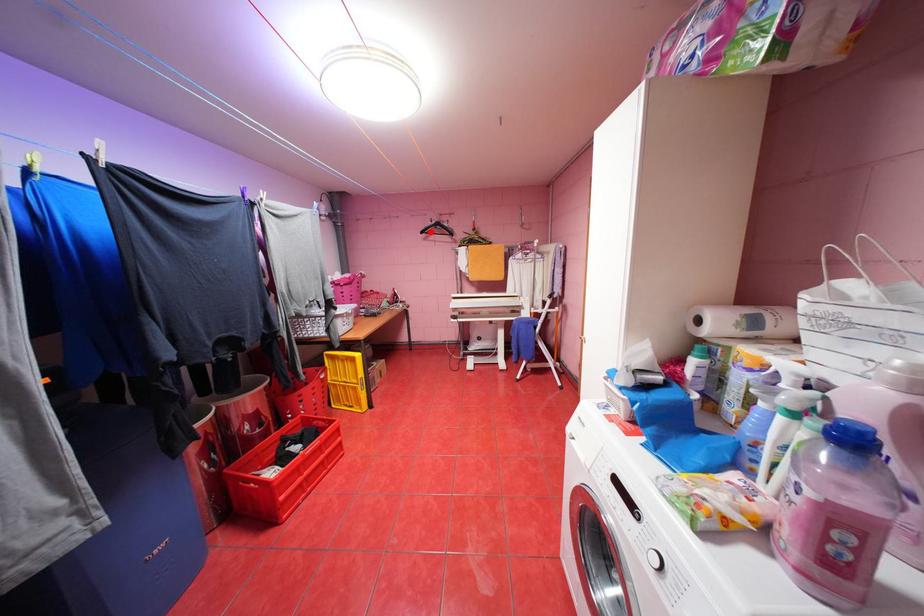
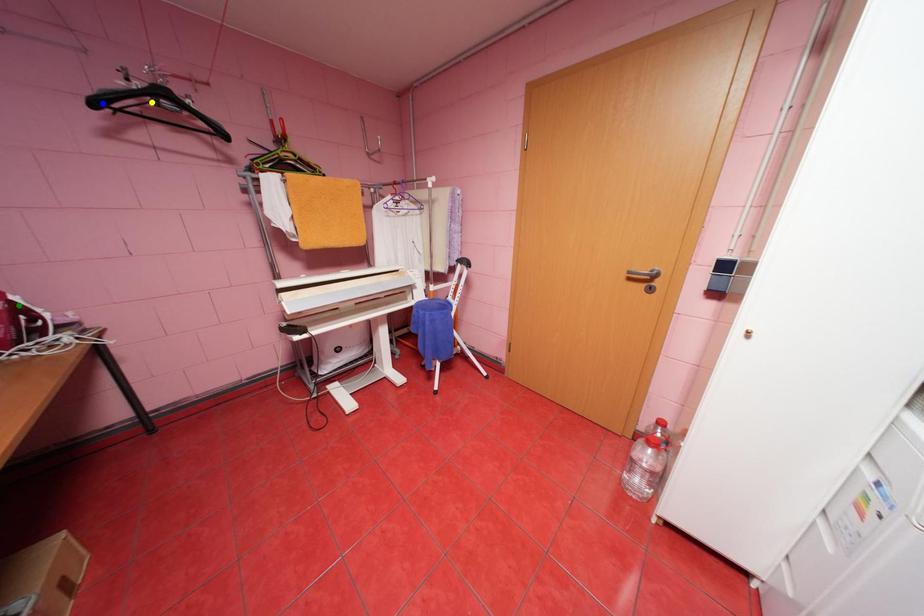
Question: I am providing you with two images of the same scene from different viewpoints. A red point is marked on the first image. You are given multiple points on the second image. In image 2, which mark is for the same physical point as the one in image 1?

Choices:
 (A) green point
 (B) yellow point
 (C) blue point

Answer: (C)